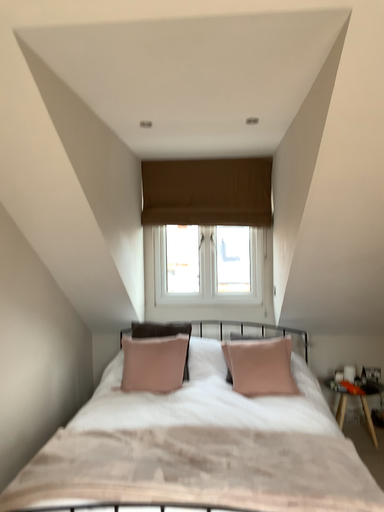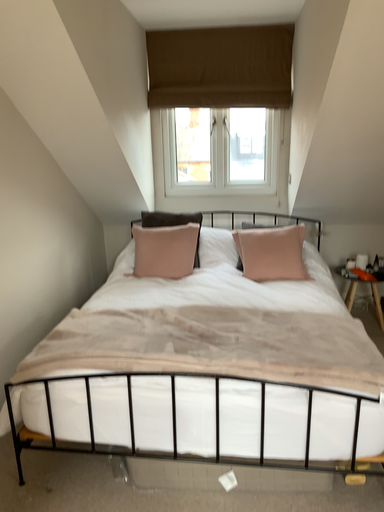
Question: Which way did the camera rotate in the video?

Choices:
 (A) rotated upward
 (B) rotated downward

Answer: (B)